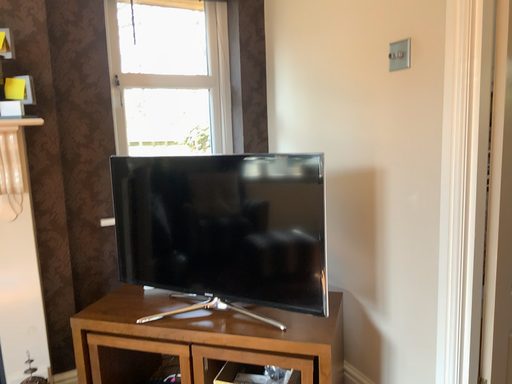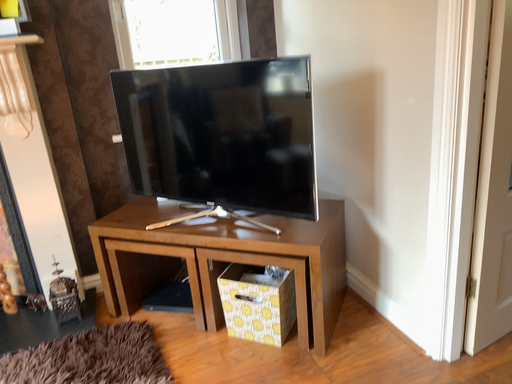
Question: How did the camera likely rotate when shooting the video?

Choices:
 (A) rotated downward
 (B) rotated upward

Answer: (A)